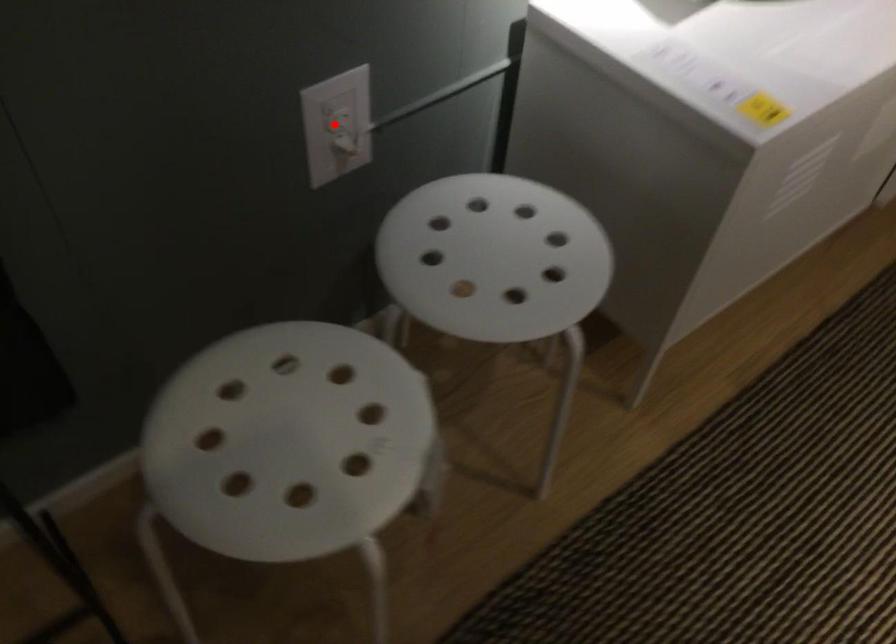
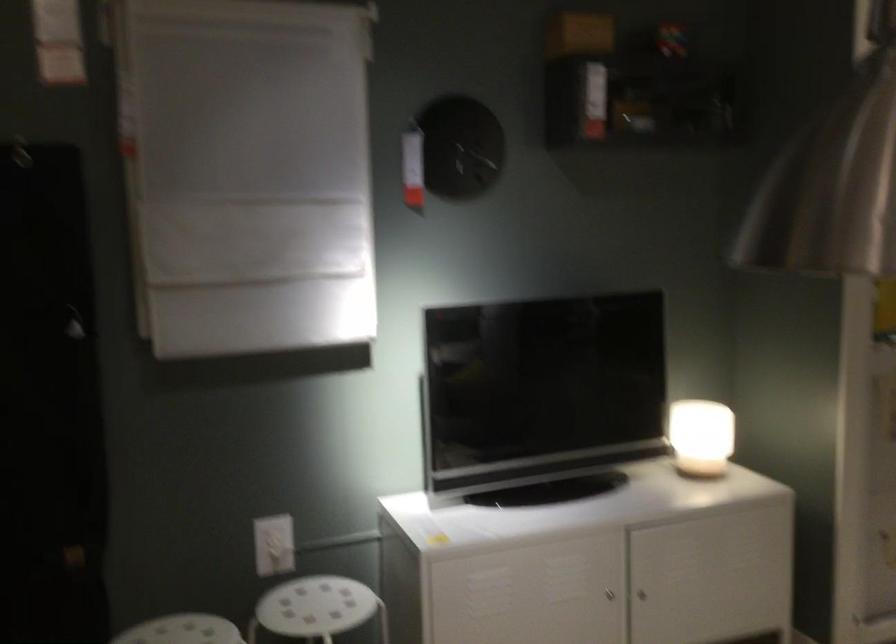
Question: I am providing you with two images of the same scene from different viewpoints. A red point is marked on the first image. At the location where the point appears in image 1, is it still visible in image 2?

Choices:
 (A) Yes
 (B) No

Answer: (A)